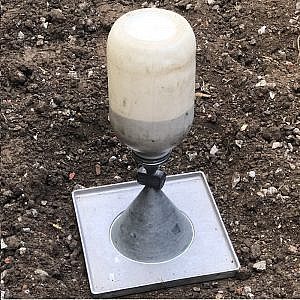
I want to click on lamp, so click(x=155, y=63).